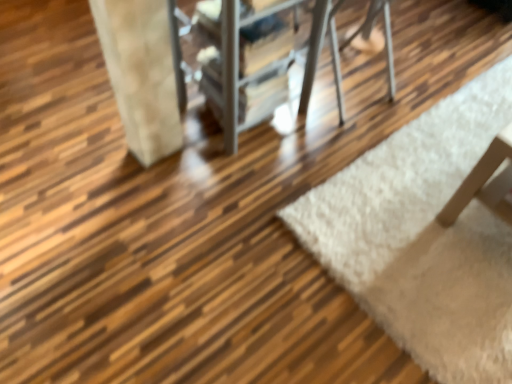
Question: From the image's perspective, is metallic silver chair at center positioned above or below white fluffy rug at lower right?

Choices:
 (A) below
 (B) above

Answer: (B)

Question: Considering their positions, is metallic silver chair at center located in front of or behind white fluffy rug at lower right?

Choices:
 (A) front
 (B) behind

Answer: (A)

Question: From a real-world perspective, is metallic silver chair at center physically located above or below white fluffy rug at lower right?

Choices:
 (A) above
 (B) below

Answer: (A)

Question: Is white fluffy rug at lower right inside the boundaries of metallic silver chair at center, or outside?

Choices:
 (A) inside
 (B) outside

Answer: (B)

Question: Considering the positions of white fluffy rug at lower right and metallic silver chair at center in the image, is white fluffy rug at lower right bigger or smaller than metallic silver chair at center?

Choices:
 (A) big
 (B) small

Answer: (B)

Question: Is point (460, 347) closer or farther from the camera than point (232, 94)?

Choices:
 (A) closer
 (B) farther

Answer: (A)

Question: From the image's perspective, is white fluffy rug at lower right located above or below metallic silver chair at center?

Choices:
 (A) above
 (B) below

Answer: (B)